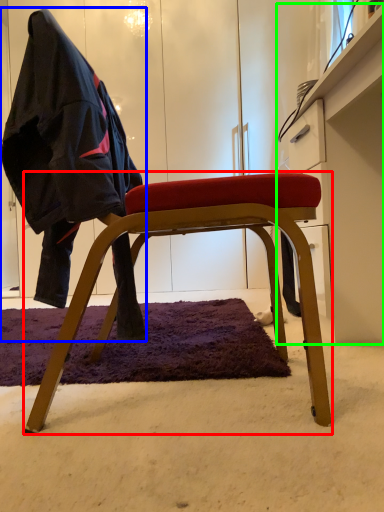
Question: Estimate the real-world distances between objects in this image. Which object is closer to chair (highlighted by a red box), person (highlighted by a blue box) or dresser (highlighted by a green box)?

Choices:
 (A) person
 (B) dresser

Answer: (A)